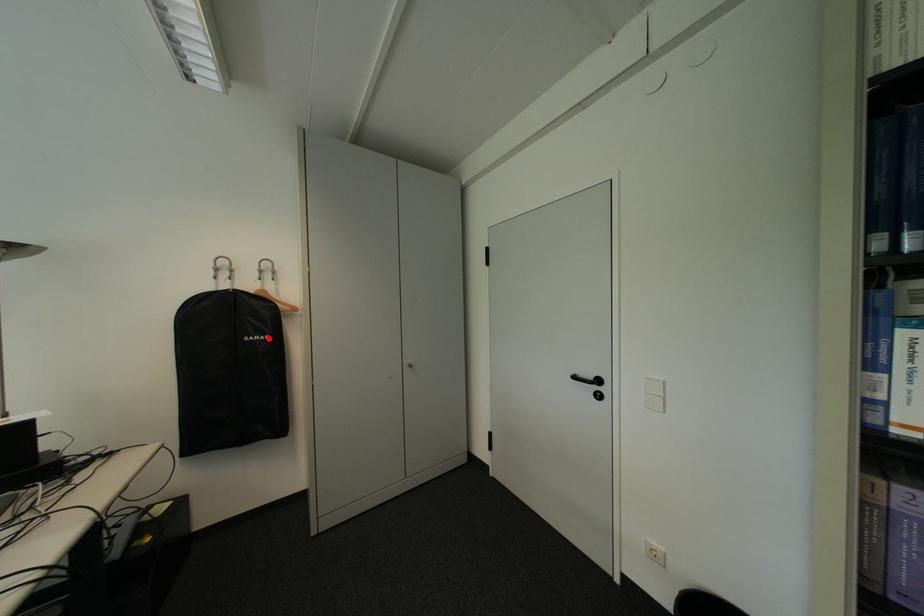
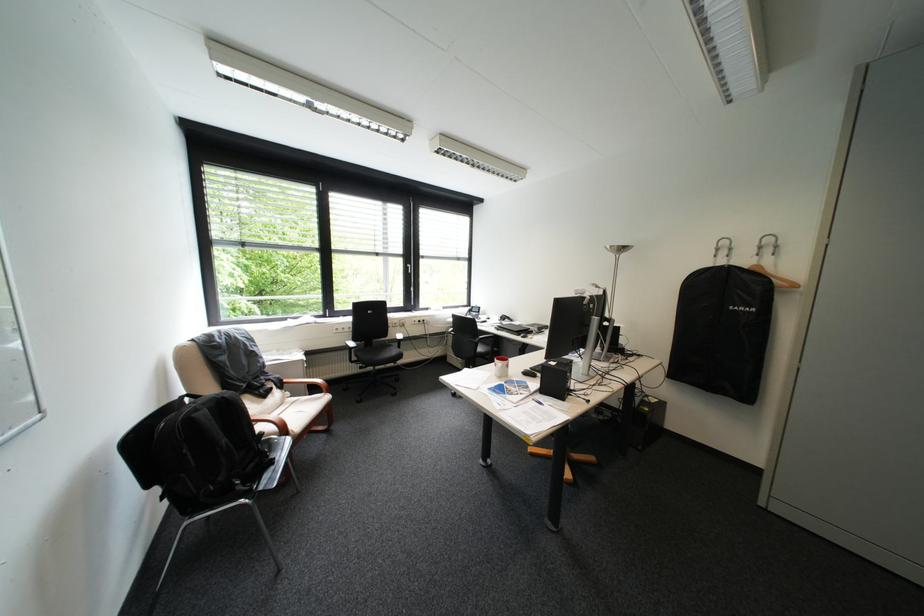
In the second image, find the point that corresponds to the highlighted location in the first image.

(755, 309)